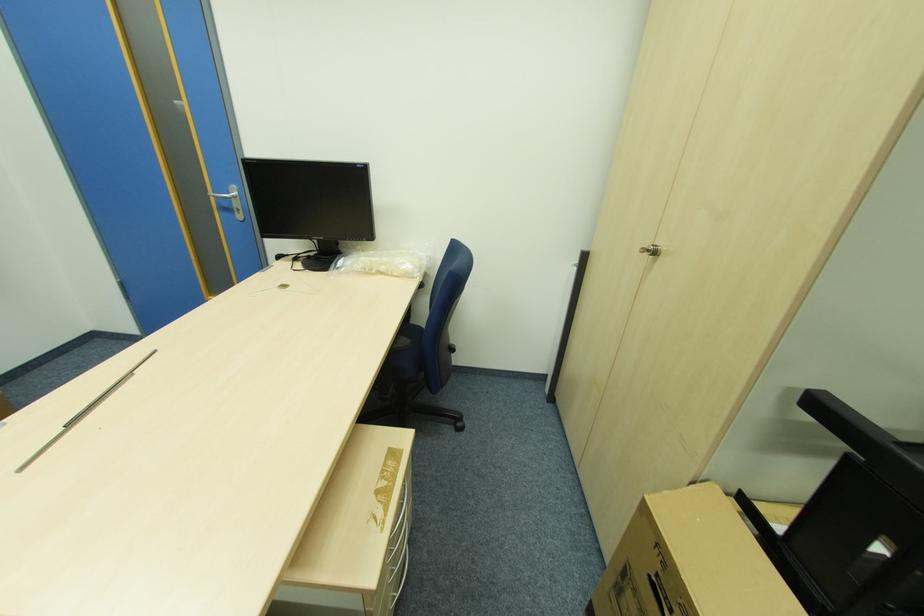
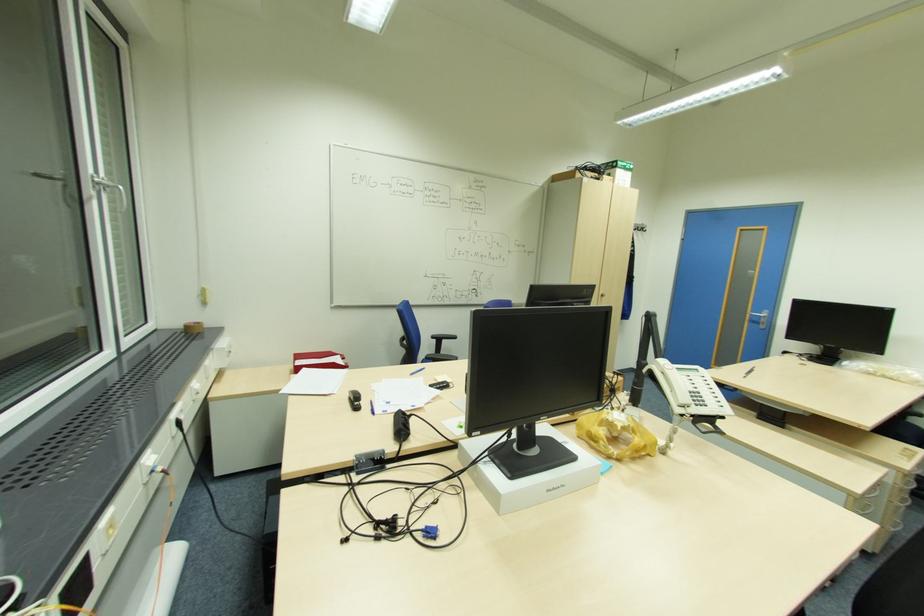
Where in the second image is the point corresponding to pixel 241 209 from the first image?

(766, 323)